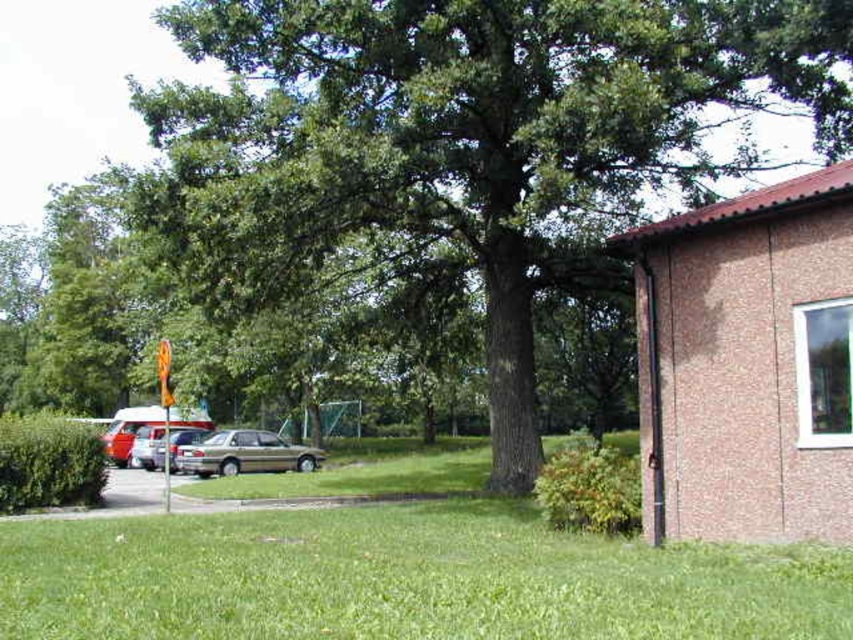
Question: Which object is positioned farthest from the metallic gold sedan at center?

Choices:
 (A) silver metallic car at center-left
 (B) green leafy tree at center

Answer: (B)

Question: Is metallic gold sedan at center positioned behind silver metallic car at center-left?

Choices:
 (A) no
 (B) yes

Answer: (A)

Question: Is metallic gold sedan at center above silver metallic car at center-left?

Choices:
 (A) yes
 (B) no

Answer: (B)

Question: Which point appears farthest from the camera in this image?

Choices:
 (A) (492, 596)
 (B) (308, 468)
 (C) (730, 60)
 (D) (169, 442)

Answer: (D)

Question: Which object is closer to the camera taking this photo?

Choices:
 (A) green leafy tree at center
 (B) metallic gold sedan at center

Answer: (A)

Question: Is metallic gold sedan at center above silver metallic car at center-left?

Choices:
 (A) yes
 (B) no

Answer: (B)